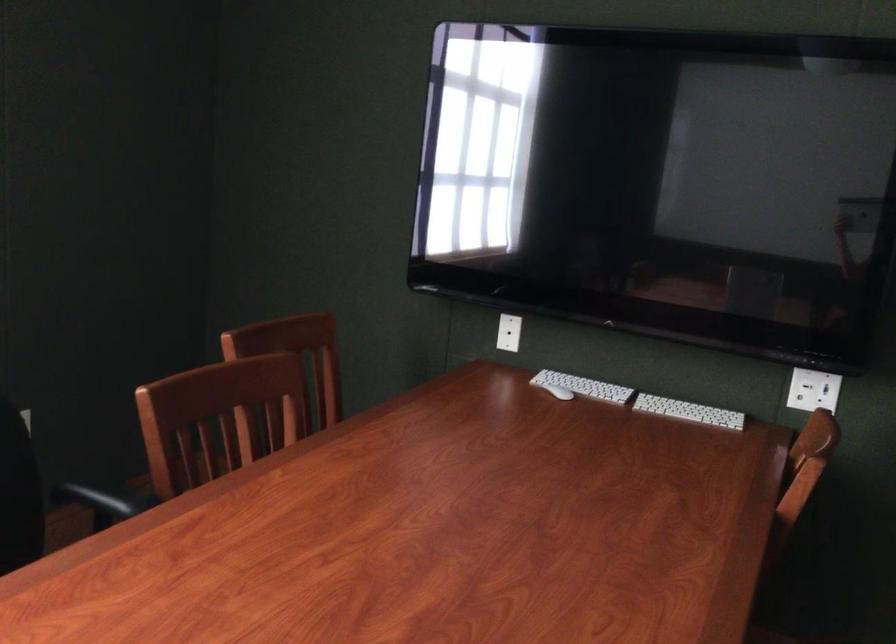
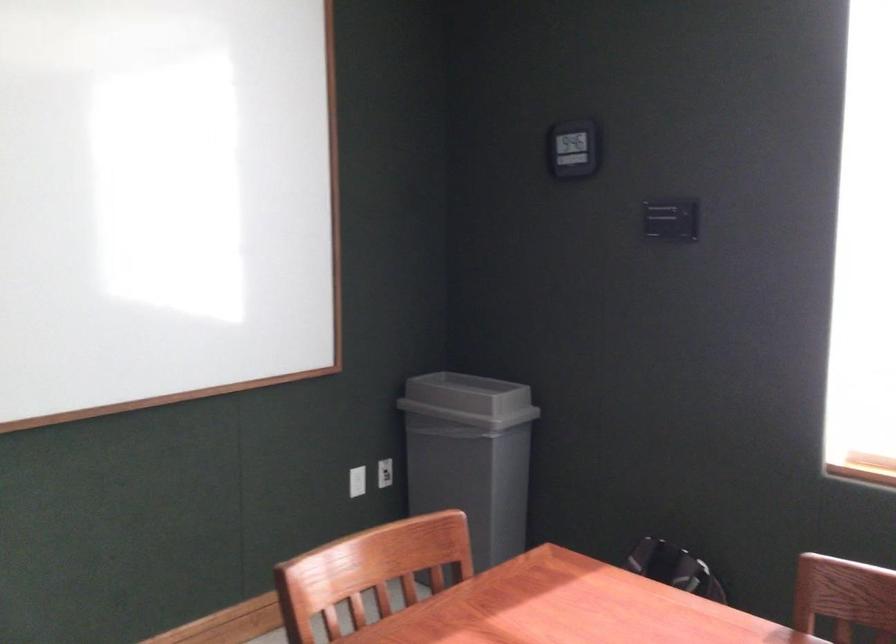
Question: Based on the continuous images, in which direction is the camera rotating? Reply with the corresponding letter.

Choices:
 (A) Left
 (B) Right
 (C) Up
 (D) Down

Answer: (A)